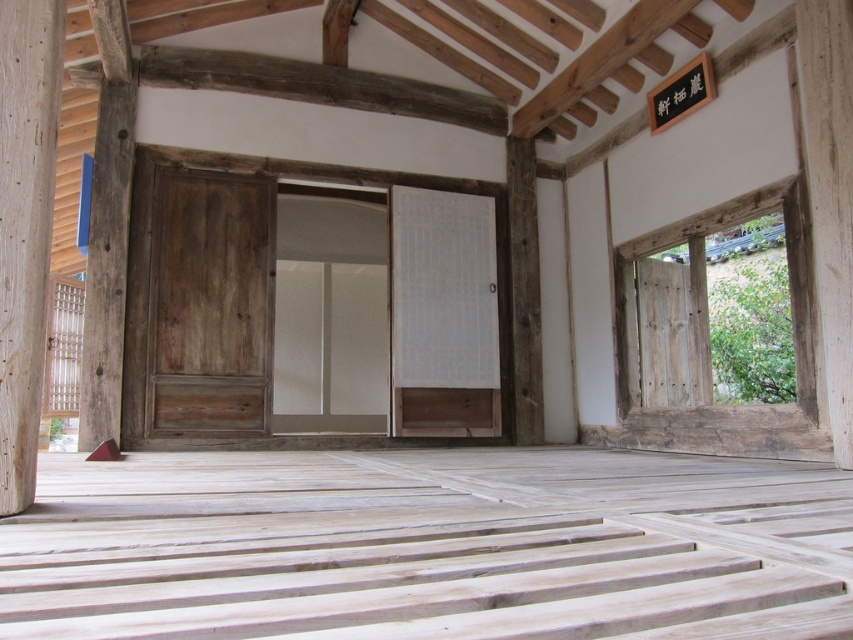
You are standing in the traditional Korean hanok room and need to determine which object is smaller between the natural wood pillar at left and the wooden post at center. Can you identify the smaller one?

The natural wood pillar at left has a smaller size compared to the wooden post at center, so the natural wood pillar at left is the smaller one.

You are standing in the traditional Korean hanok room and want to move from the entrance to the back wall. There is a natural wood pillar at left and a wooden post at center in your path. Which object should you go around first?

You should go around the natural wood pillar at left first because it is closer to you than the wooden post at center.

In the scene shown: You are standing in the traditional Korean hanok room and want to hang a decorative item on the wall. You have two options for placement near the natural wood pillar at left and the wooden post at center. According to their positions, which object should you choose to place the decoration above?

The natural wood pillar at left is located above the wooden post at center, so placing the decoration above the natural wood pillar at left would be appropriate since it is positioned higher up.